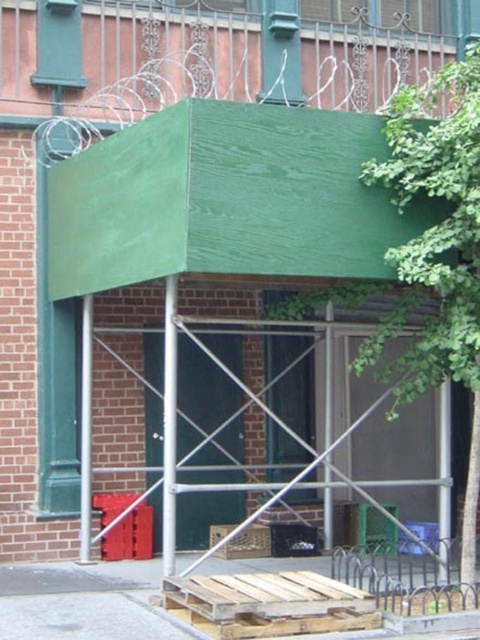
Question: Which point is farther to the camera?

Choices:
 (A) green leafy tree at upper center
 (B) brown cardboard crate at center

Answer: (B)

Question: Which point is closer to the camera?

Choices:
 (A) green leafy tree at upper center
 (B) brown cardboard crate at center

Answer: (A)

Question: Which object appears farthest from the camera in this image?

Choices:
 (A) brown cardboard crate at center
 (B) green leafy tree at upper center

Answer: (A)

Question: Does green leafy tree at upper center lie behind brown cardboard crate at center?

Choices:
 (A) yes
 (B) no

Answer: (B)

Question: Is green leafy tree at upper center wider than brown cardboard crate at center?

Choices:
 (A) yes
 (B) no

Answer: (A)

Question: Does green leafy tree at upper center have a greater width compared to brown cardboard crate at center?

Choices:
 (A) yes
 (B) no

Answer: (A)